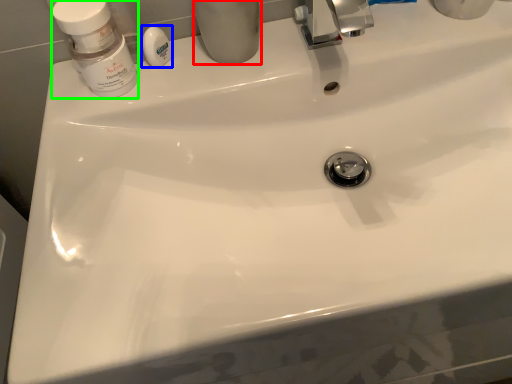
Question: Based on their relative distances, which object is nearer to toiletry (highlighted by a red box)? Choose from soap (highlighted by a blue box) and mouthwash (highlighted by a green box).

Choices:
 (A) soap
 (B) mouthwash

Answer: (A)